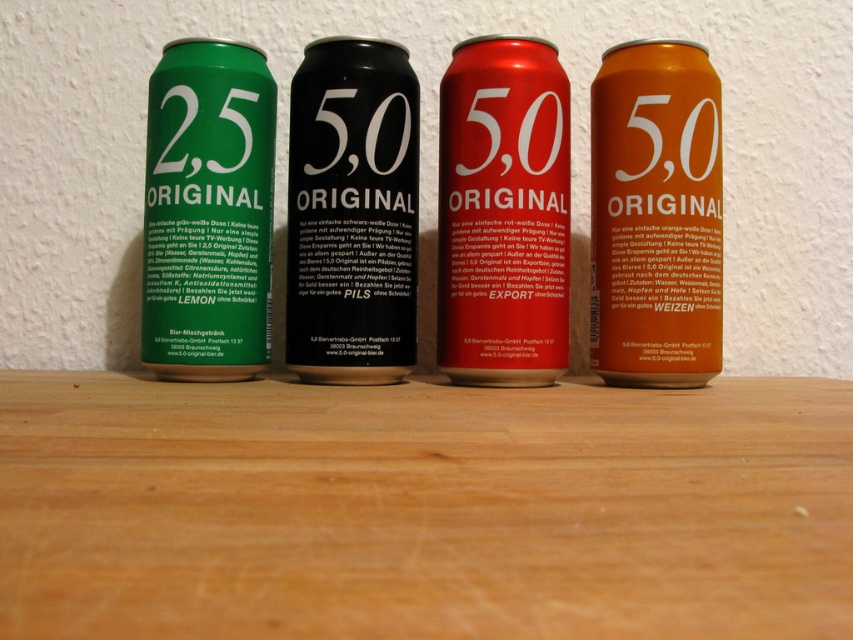
Is shiny metallic can at center thinner than green matte can at left?

Incorrect, shiny metallic can at center's width is not less than green matte can at left's.

Can you confirm if shiny metallic can at center is positioned below green matte can at left?

Yes.

Is point (554, 260) farther from viewer compared to point (198, 81)?

No, (554, 260) is in front of (198, 81).

The width and height of the screenshot is (853, 640). What are the coordinates of `shiny metallic can at center` in the screenshot? It's located at (503, 212).

Between shiny metallic can at center and black matte can at center, which one has more height?

Standing taller between the two is shiny metallic can at center.

How much distance is there between shiny metallic can at center and black matte can at center?

They are 4.12 inches apart.

Locate an element on the screen. The image size is (853, 640). shiny metallic can at center is located at coordinates (503, 212).

Identify the location of shiny metallic can at center. This screenshot has width=853, height=640. (503, 212).

Which is in front, point (380, 163) or point (181, 140)?

Point (380, 163) is more forward.

Can you confirm if black matte can at center is positioned below green matte can at left?

Yes, black matte can at center is below green matte can at left.

Locate an element on the screen. This screenshot has height=640, width=853. black matte can at center is located at coordinates (352, 212).